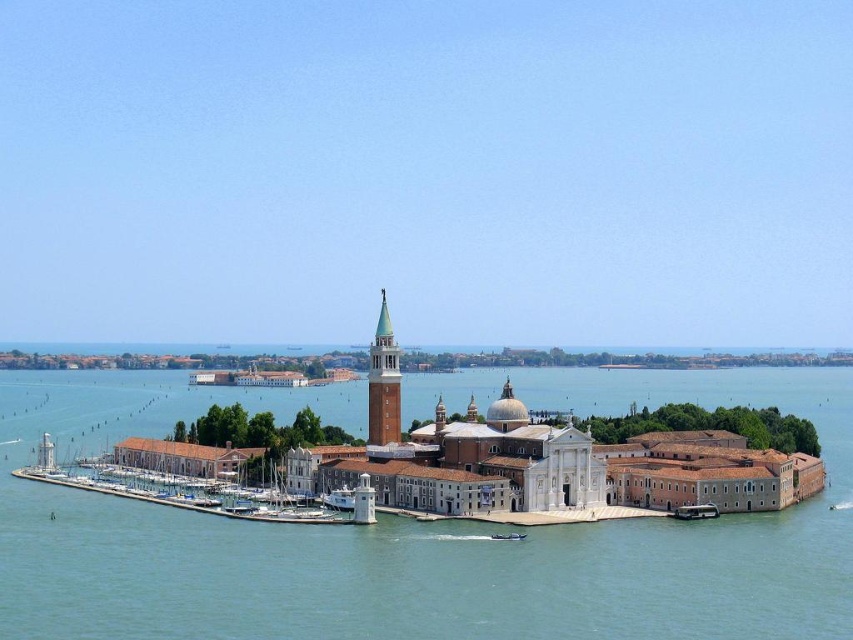
Between white wooden dock at lower left and greenish-brown stone tower at center, which one appears on the right side from the viewer's perspective?

greenish-brown stone tower at center is more to the right.

Is white wooden dock at lower left smaller than greenish-brown stone tower at center?

No.

Is point (312, 518) farther from viewer compared to point (379, 369)?

No, it is not.

Identify the location of white wooden dock at lower left. [196, 493].

From the picture: Between greenish-brown stone tower at center and white plastic boat at lower right, which one appears on the right side from the viewer's perspective?

white plastic boat at lower right is more to the right.

Does greenish-brown stone tower at center appear over white plastic boat at lower right?

Correct, greenish-brown stone tower at center is located above white plastic boat at lower right.

The image size is (853, 640). I want to click on greenish-brown stone tower at center, so click(383, 381).

Locate an element on the screen. This screenshot has height=640, width=853. greenish-brown stone tower at center is located at coordinates (383, 381).

Between point (378, 371) and point (497, 540), which one is positioned behind?

Positioned behind is point (378, 371).

Can you confirm if greenish-brown stone tower at center is wider than metallic gray boat at lower center?

Yes.

You are a GUI agent. You are given a task and a screenshot of the screen. Output one action in this format:
    pyautogui.click(x=<x>, y=<y>)
    Task: Click on the greenish-brown stone tower at center
    Image resolution: width=853 pixels, height=640 pixels.
    Given the screenshot: What is the action you would take?
    pyautogui.click(x=383, y=381)

I want to click on greenish-brown stone tower at center, so click(383, 381).